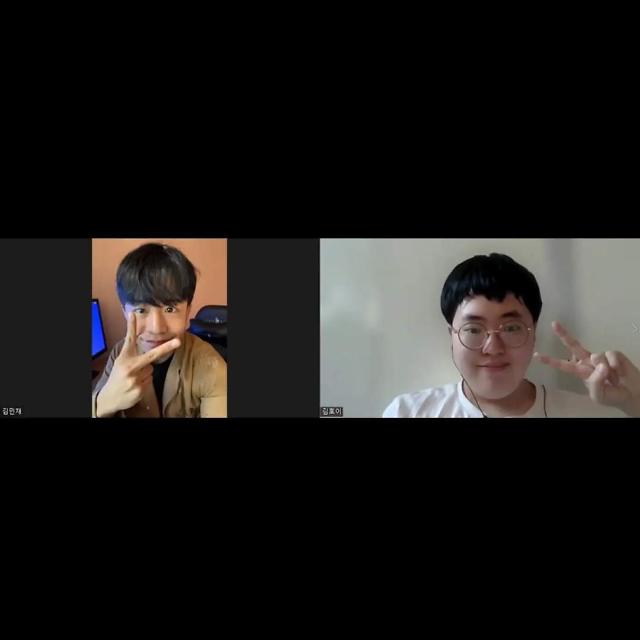
The height and width of the screenshot is (640, 640). Identify the location of wall. (361, 333).